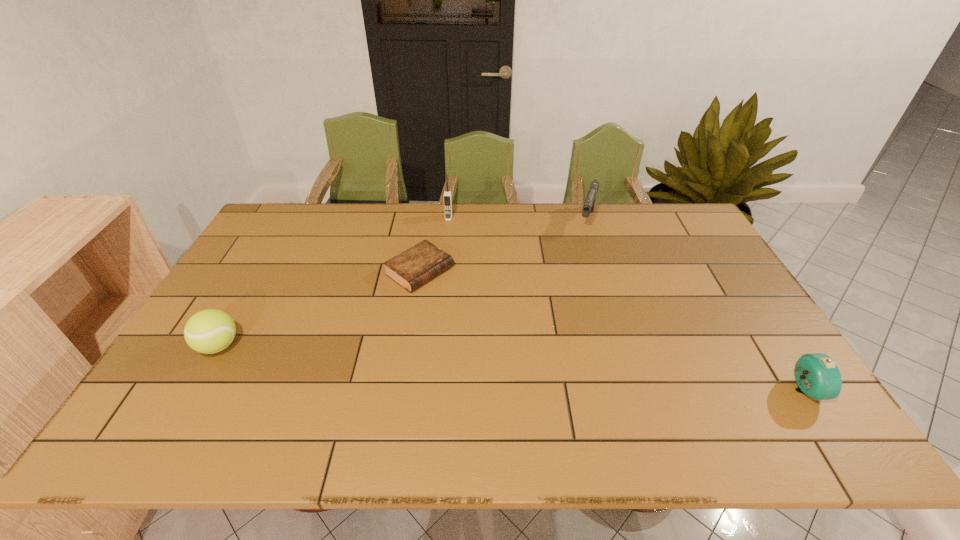
The width and height of the screenshot is (960, 540). Find the location of `free spot on the desktop that is between the second nearest object and the alarm clock and is positioned in the direction the gun is aimed`. free spot on the desktop that is between the second nearest object and the alarm clock and is positioned in the direction the gun is aimed is located at coordinates (535, 370).

The height and width of the screenshot is (540, 960). Find the location of `vacant space on the desktop that is between the tennis ball and the rightmost object and is positioned on the spine side of the shortest object`. vacant space on the desktop that is between the tennis ball and the rightmost object and is positioned on the spine side of the shortest object is located at coordinates (565, 373).

Find the location of `vacant spot on the desktop that is between the leftmost object and the nearest object and is positioned on the front-facing side of the tallest object`. vacant spot on the desktop that is between the leftmost object and the nearest object and is positioned on the front-facing side of the tallest object is located at coordinates click(427, 362).